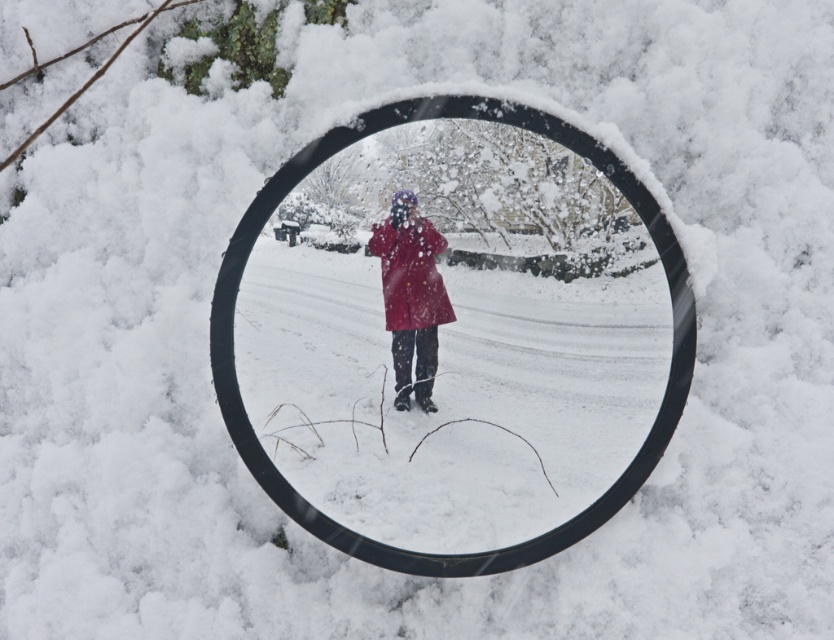
You are an outdoor photographer trying to capture the reflection of the scene in the mirror. You have a black plastic magnifying glass at center and a matte red coat at center in your shot. Which object will appear bigger in the photo?

The black plastic magnifying glass at center will appear bigger in the photo because it is larger in size than the matte red coat at center.

You are a detective examining the scene and need to determine the position of the black plastic magnifying glass at center relative to the matte red coat at center. Based on the snowy environment shown in the mirror, which object is located to the right?

The black plastic magnifying glass at center is positioned on the right side of matte red coat at center, so the magnifying glass is to the right of the coat.

You are standing in the snowy landscape and want to pick up the black plastic magnifying glass at center. Which direction should you move to reach it?

The black plastic magnifying glass at center is located at the central area of the scene, so you should move towards the center of the snowy landscape to reach it.